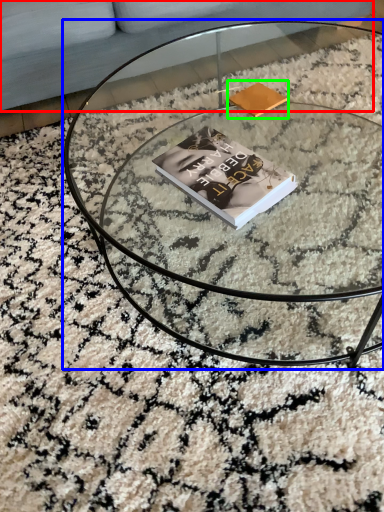
Question: Based on their relative distances, which object is nearer to couch (highlighted by a red box)? Choose from coffee table (highlighted by a blue box) and paperback book (highlighted by a green box).

Choices:
 (A) coffee table
 (B) paperback book

Answer: (A)